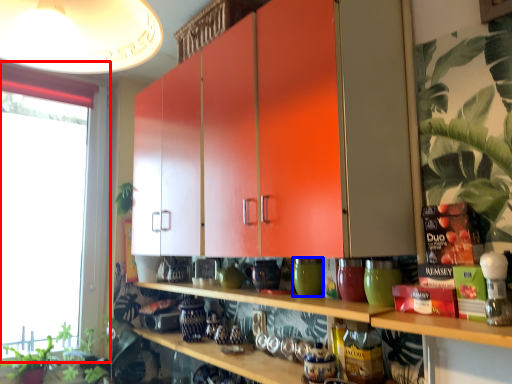
Question: Which object is further to the camera taking this photo, window (highlighted by a red box) or pottery (highlighted by a blue box)?

Choices:
 (A) window
 (B) pottery

Answer: (A)